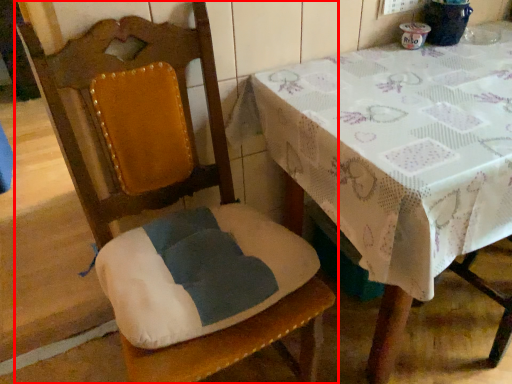
Question: From the image's perspective, where is chair (annotated by the red box) located relative to table?

Choices:
 (A) below
 (B) above

Answer: (A)